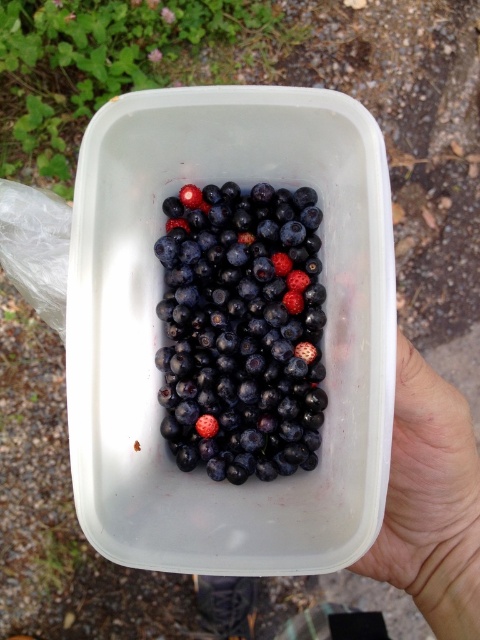
Does point (245, 259) lie in front of point (208, 435)?

That is False.

Between point (187, 428) and point (203, 426), which one is positioned in front?

Point (203, 426) is in front.

Who is more forward, [166,296] or [207,420]?

Point [207,420] is in front.

The image size is (480, 640). In order to click on shiny dark blue berries at center in this screenshot , I will do `click(241, 330)`.

Does point (313, 250) lie in front of point (407, 442)?

No, (313, 250) is behind (407, 442).

Who is more distant from viewer, (168, 323) or (403, 406)?

Positioned behind is point (168, 323).

Where is `shiny dark blue berries at center`? This screenshot has width=480, height=640. shiny dark blue berries at center is located at coordinates pos(241,330).

Can you confirm if white smooth hand at lower right is positioned below glossy blueberry at center?

Yes.

This screenshot has width=480, height=640. What do you see at coordinates (428, 490) in the screenshot?
I see `white smooth hand at lower right` at bounding box center [428, 490].

Does point (372, 577) come behind point (213, 428)?

That is False.

Where is `white smooth hand at lower right`? Image resolution: width=480 pixels, height=640 pixels. white smooth hand at lower right is located at coordinates (428, 490).